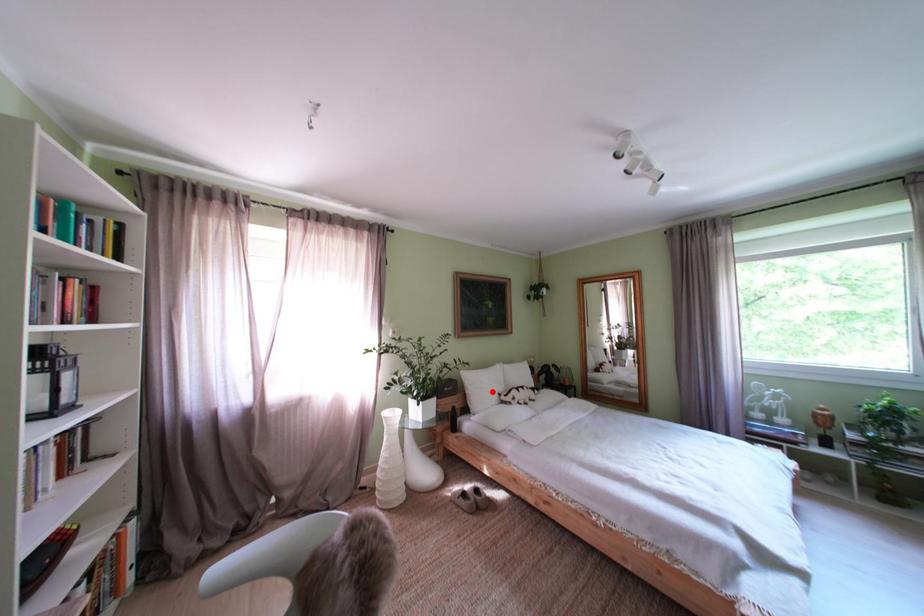
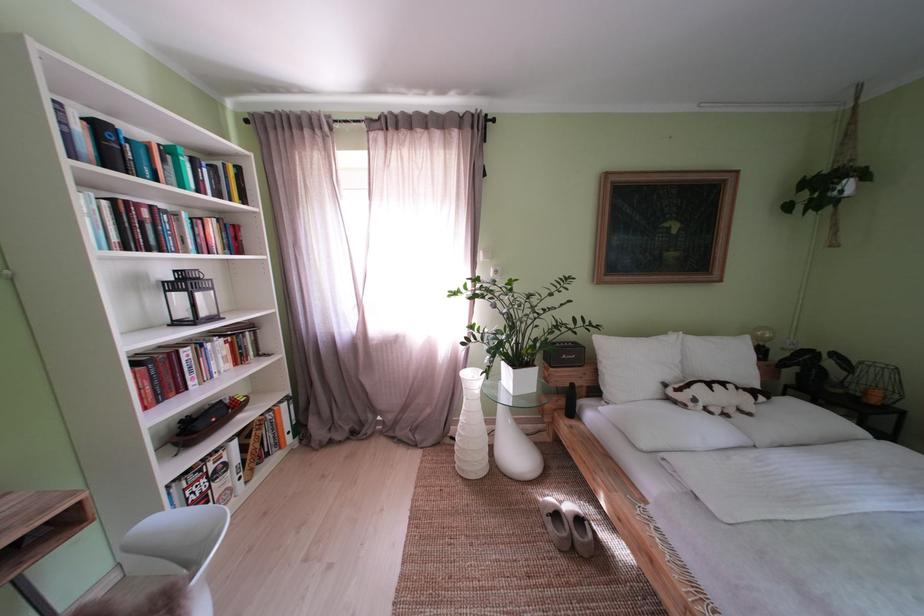
Find the pixel in the second image that matches the highlighted location in the first image.

(639, 369)